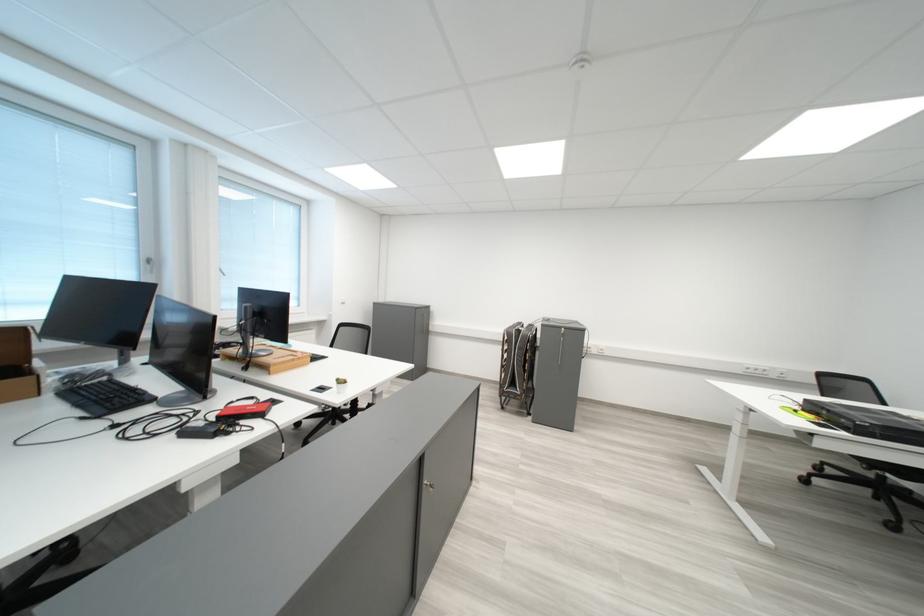
Where would you lift the folded black chair? Please return your answer as a coordinate pair (x, y).

(517, 363)